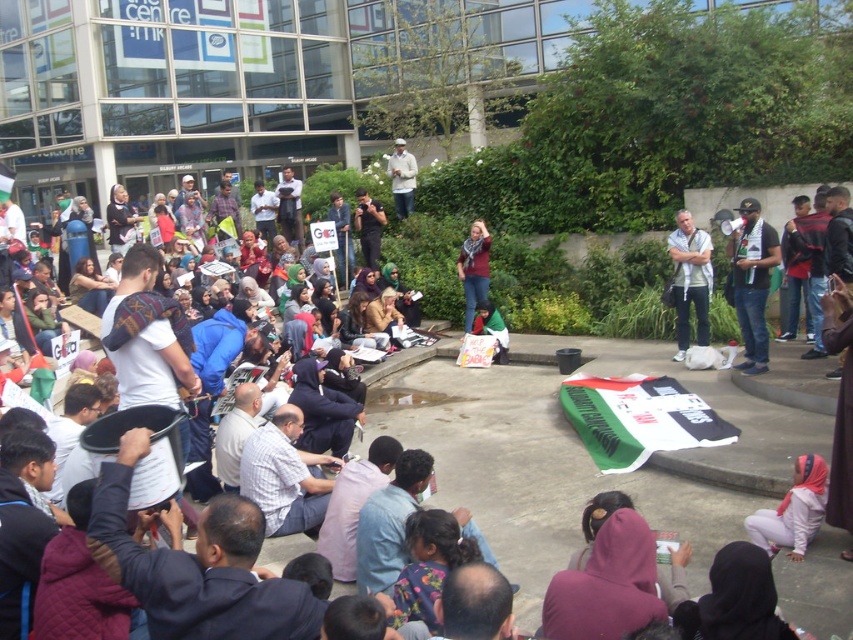
Question: Which object is positioned closest to the matte black camera at center?

Choices:
 (A) jeans at right
 (B) pale pink fabric headscarf at lower right

Answer: (A)

Question: Is red scarf at center to the left of white matte jacket at upper center from the viewer's perspective?

Choices:
 (A) yes
 (B) no

Answer: (B)

Question: Can you confirm if jeans at right is smaller than red scarf at center?

Choices:
 (A) no
 (B) yes

Answer: (A)

Question: Does jeans at right appear under red scarf at center?

Choices:
 (A) yes
 (B) no

Answer: (A)

Question: Which point is closer to the camera?

Choices:
 (A) matte black camera at center
 (B) white cotton shirt at upper right
 (C) pale pink fabric headscarf at lower right

Answer: (C)

Question: Among these objects, which one is farthest from the camera?

Choices:
 (A) jeans at right
 (B) white matte jacket at upper center
 (C) matte black camera at center
 (D) red scarf at center

Answer: (B)